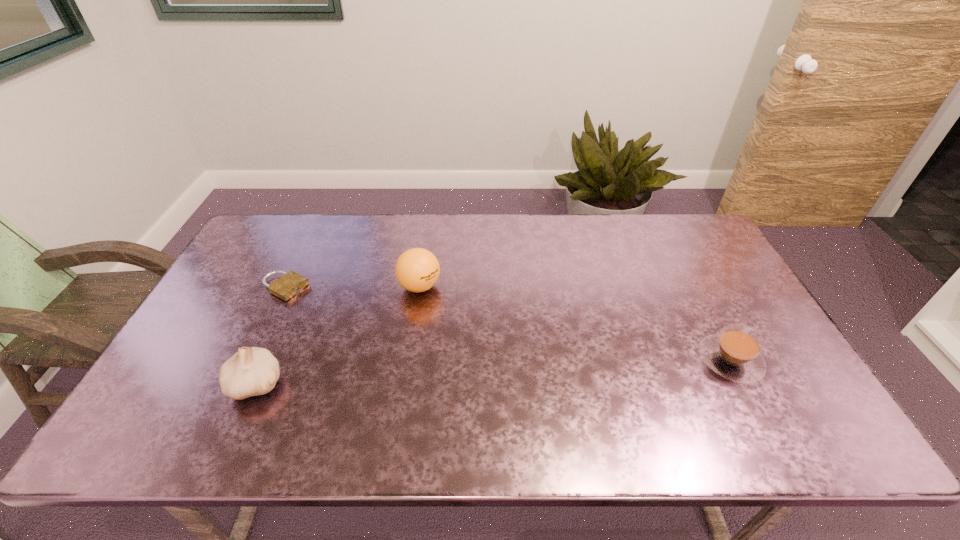
Where is `free region located on the keyhole side of the shortest object`? free region located on the keyhole side of the shortest object is located at coordinates (357, 323).

This screenshot has height=540, width=960. What are the coordinates of `free point located 0.380m on the keyhole side of the shortest object` in the screenshot? It's located at point(402,346).

This screenshot has width=960, height=540. Find the location of `vacant area situated 0.130m on the keyhole side of the shortest object`. vacant area situated 0.130m on the keyhole side of the shortest object is located at coordinates (334, 311).

Where is `garlic that is at the near edge`? This screenshot has height=540, width=960. garlic that is at the near edge is located at coordinates (251, 371).

This screenshot has width=960, height=540. What are the coordinates of `cappuccino located at the near edge` in the screenshot? It's located at (735, 354).

Identify the location of object that is at the left edge. The height and width of the screenshot is (540, 960). (291, 283).

Locate an element on the screen. Image resolution: width=960 pixels, height=540 pixels. object present at the right edge is located at coordinates (735, 354).

This screenshot has width=960, height=540. In order to click on object located at the near right corner in this screenshot , I will do pyautogui.click(x=735, y=354).

In the image, there is a desktop. Where is `free region at the far edge`? The width and height of the screenshot is (960, 540). free region at the far edge is located at coordinates (536, 241).

In the image, there is a desktop. At what (x,y) coordinates should I click in order to perform the action: click on vacant space at the near edge. Please return your answer as a coordinate pair (x, y). The image size is (960, 540). Looking at the image, I should click on (735, 384).